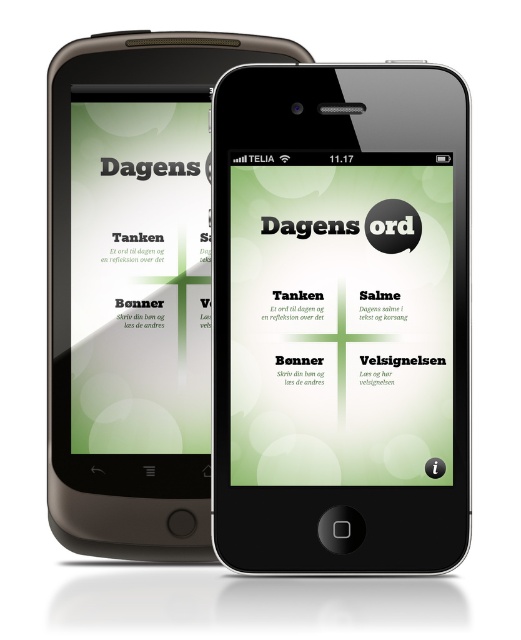
You are examining the two points on the image, point 1 at coordinates (287, 340) and point 2 at coordinates (104, 308). Which point is closer to you?

Point 1 at coordinates (287, 340) is closer to the viewer than point 2 at coordinates (104, 308).